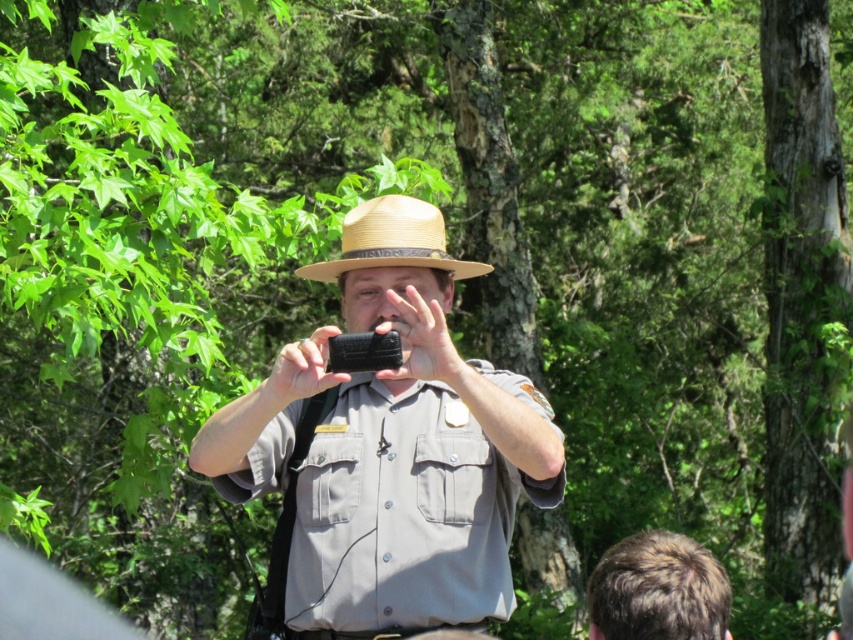
Measure the distance between point (477,468) and camera.

The distance of point (477,468) from camera is 3.82 meters.

Which of these two, gray matte uniform at center or brown hair at lower right, stands shorter?

With less height is brown hair at lower right.

At what (x,y) coordinates should I click in order to perform the action: click on gray matte uniform at center. Please return your answer as a coordinate pair (x, y). Looking at the image, I should click on (392, 445).

Between point (338, 570) and point (456, 269), which one is positioned in front?

Point (338, 570) is more forward.

Does point (560, 492) come in front of point (415, 205)?

Yes, it is.

This screenshot has height=640, width=853. Find the location of `gray matte uniform at center`. gray matte uniform at center is located at coordinates (392, 445).

Between brown hair at lower right and natural straw cowboy hat at center, which one is positioned higher?

natural straw cowboy hat at center

Who is taller, brown hair at lower right or natural straw cowboy hat at center?

brown hair at lower right is taller.

Which is behind, point (648, 593) or point (369, 220)?

Point (369, 220)

Where is `brown hair at lower right`? brown hair at lower right is located at coordinates (659, 589).